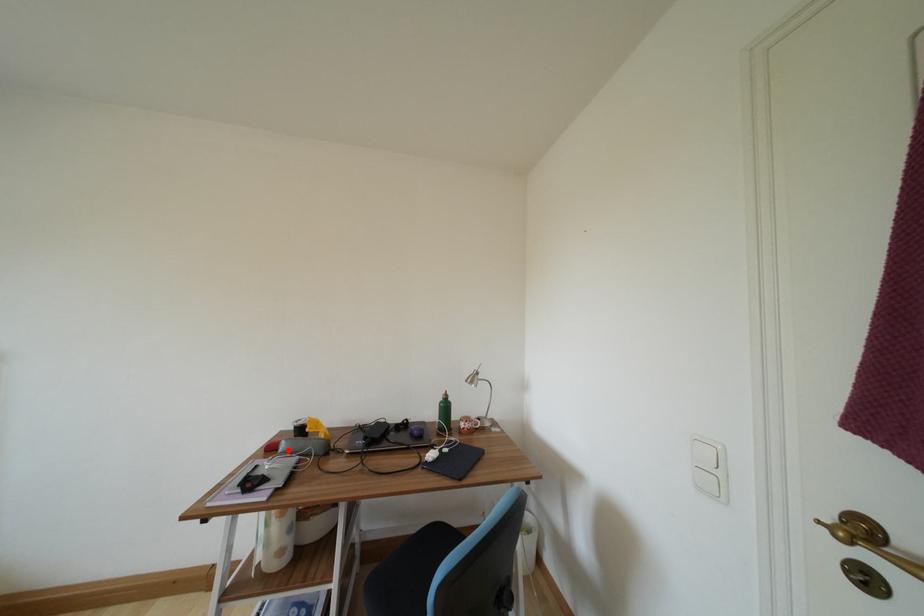
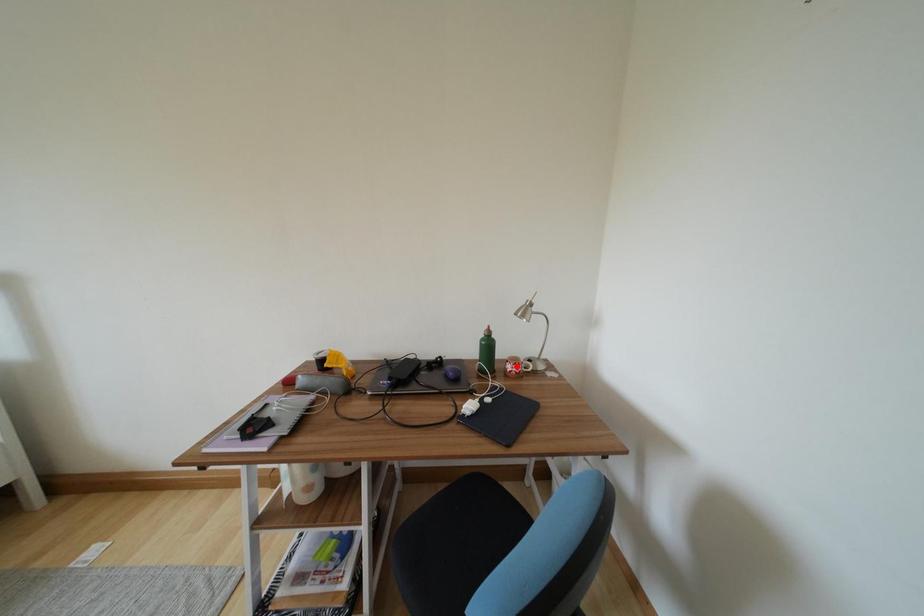
I am providing you with two images of the same scene from different viewpoints. A red point is marked on the first image and another point is marked on the second image. Is the red point in image1 aligned with the point shown in image2?

No